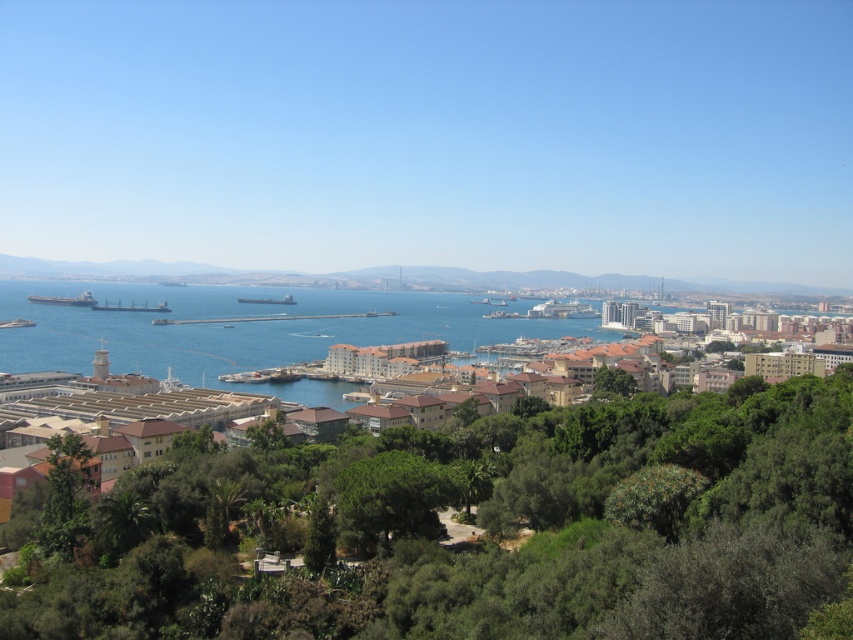
You are standing at the edge of the coastal city park and want to take a photo of both the green leafy tree at center and the green leafy tree at lower center. Which tree should you position yourself closer to if you want the other tree to appear to your left in the photo?

To have the green leafy tree at lower center appear to your left in the photo, you should position yourself closer to the green leafy tree at center since it is located to the right of the green leafy tree at lower center.

You are planning to plant a new tree in the park. The green leafy tree at lower center is currently blocking the view of the brown textured buildings at center. Can you determine if the tree is wide enough to completely block the view of the buildings?

The brown textured buildings at center might be wider than green leafy tree at lower center, so it is possible that the tree is not wide enough to completely block the view of the buildings.

You are standing in the coastal city park and want to take a photo of the green leafy tree at center and the blue water at center. Which object will appear closer to you in the photo?

The green leafy tree at center will appear closer to you in the photo because it is in front of the blue water at center.